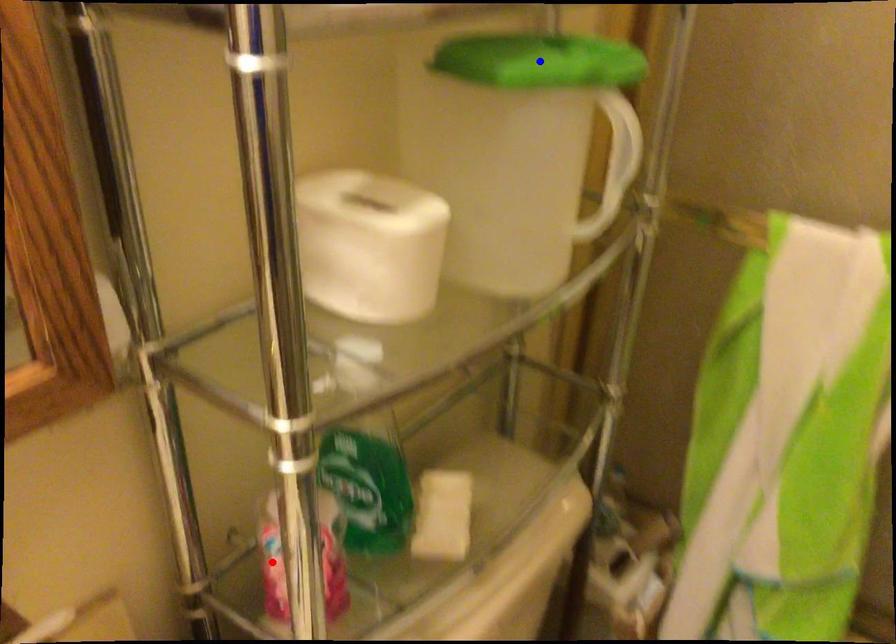
Question: Two points are marked on the image. Which point is closer to the camera?

Choices:
 (A) Blue point is closer.
 (B) Red point is closer.

Answer: (A)